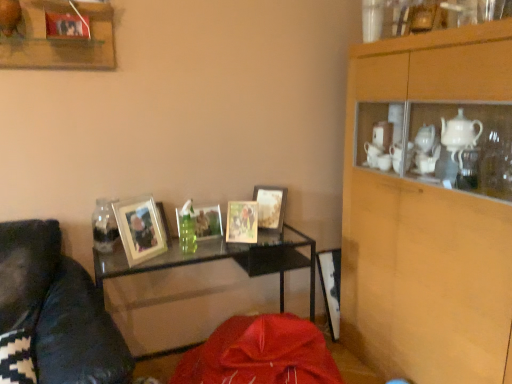
Question: Considering the relative sizes of wooden frame at upper left and matte silver picture frame at center-left, placed as the 1th picture frame when sorted from left to right, in the image provided, is wooden frame at upper left thinner than matte silver picture frame at center-left, placed as the 1th picture frame when sorted from left to right,?

Choices:
 (A) yes
 (B) no

Answer: (B)

Question: Does wooden frame at upper left have a larger size compared to matte silver picture frame at center-left, placed as the 1th picture frame when sorted from left to right?

Choices:
 (A) no
 (B) yes

Answer: (B)

Question: From the image's perspective, does wooden frame at upper left appear lower than matte silver picture frame at center-left, acting as the fourth picture frame starting from the right?

Choices:
 (A) no
 (B) yes

Answer: (A)

Question: Does wooden frame at upper left have a greater width compared to matte silver picture frame at center-left, acting as the fourth picture frame starting from the right?

Choices:
 (A) yes
 (B) no

Answer: (A)

Question: Is wooden frame at upper left placed right next to matte silver picture frame at center-left, acting as the fourth picture frame starting from the right?

Choices:
 (A) yes
 (B) no

Answer: (B)

Question: Based on their positions, is wooden cabinet at upper right located to the left or right of wooden photo frame at center, positioned as the 4th picture frame in left-to-right order?

Choices:
 (A) right
 (B) left

Answer: (A)

Question: From a real-world perspective, is wooden cabinet at upper right positioned above or below wooden photo frame at center, placed as the first picture frame when sorted from right to left?

Choices:
 (A) above
 (B) below

Answer: (B)

Question: Which is correct: wooden cabinet at upper right is inside wooden photo frame at center, positioned as the 4th picture frame in left-to-right order, or outside of it?

Choices:
 (A) outside
 (B) inside

Answer: (A)

Question: From the image's perspective, relative to wooden photo frame at center, placed as the first picture frame when sorted from right to left, is wooden cabinet at upper right above or below?

Choices:
 (A) below
 (B) above

Answer: (A)

Question: In the image, is metallic silver picture frame at center, acting as the 2th picture frame starting from the left, positioned in front of or behind wooden frame at upper left?

Choices:
 (A) behind
 (B) front

Answer: (A)

Question: From the image's perspective, relative to wooden frame at upper left, is metallic silver picture frame at center, the 3th picture frame from the right, above or below?

Choices:
 (A) below
 (B) above

Answer: (A)

Question: In terms of width, does metallic silver picture frame at center, acting as the 2th picture frame starting from the left, look wider or thinner when compared to wooden frame at upper left?

Choices:
 (A) wide
 (B) thin

Answer: (B)

Question: Based on their sizes in the image, would you say metallic silver picture frame at center, the 3th picture frame from the right, is bigger or smaller than wooden frame at upper left?

Choices:
 (A) big
 (B) small

Answer: (B)

Question: Is matte silver picture frame at center-left, acting as the fourth picture frame starting from the right, taller or shorter than wooden cabinet at upper right?

Choices:
 (A) tall
 (B) short

Answer: (B)

Question: Looking at their shapes, would you say matte silver picture frame at center-left, placed as the 1th picture frame when sorted from left to right, is wider or thinner than wooden cabinet at upper right?

Choices:
 (A) thin
 (B) wide

Answer: (A)